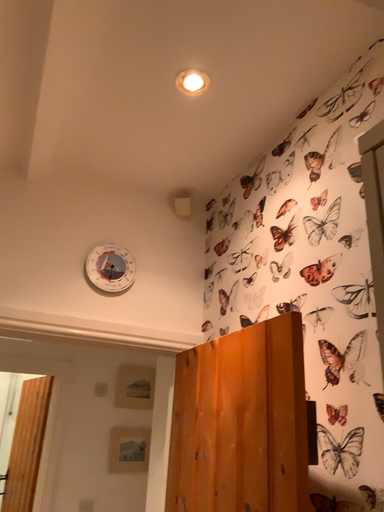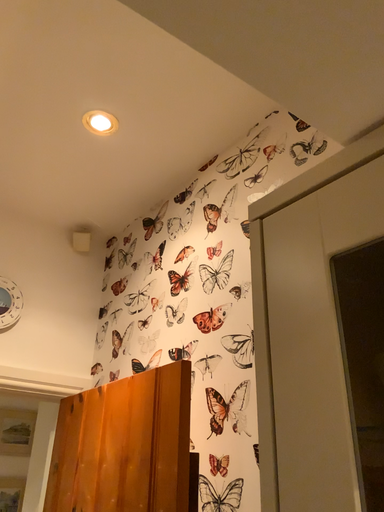
Question: How did the camera likely rotate when shooting the video?

Choices:
 (A) rotated right
 (B) rotated left

Answer: (A)